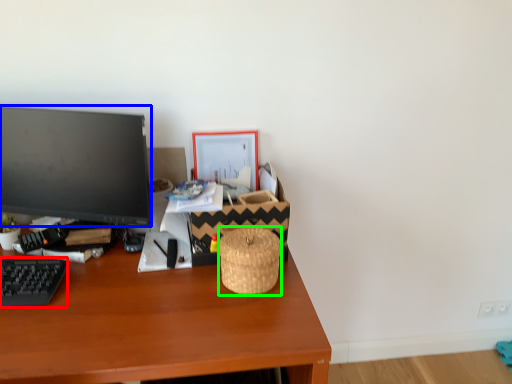
Question: Based on their relative distances, which object is nearer to computer keyboard (highlighted by a red box)? Choose from television (highlighted by a blue box) and basket (highlighted by a green box).

Choices:
 (A) television
 (B) basket

Answer: (A)